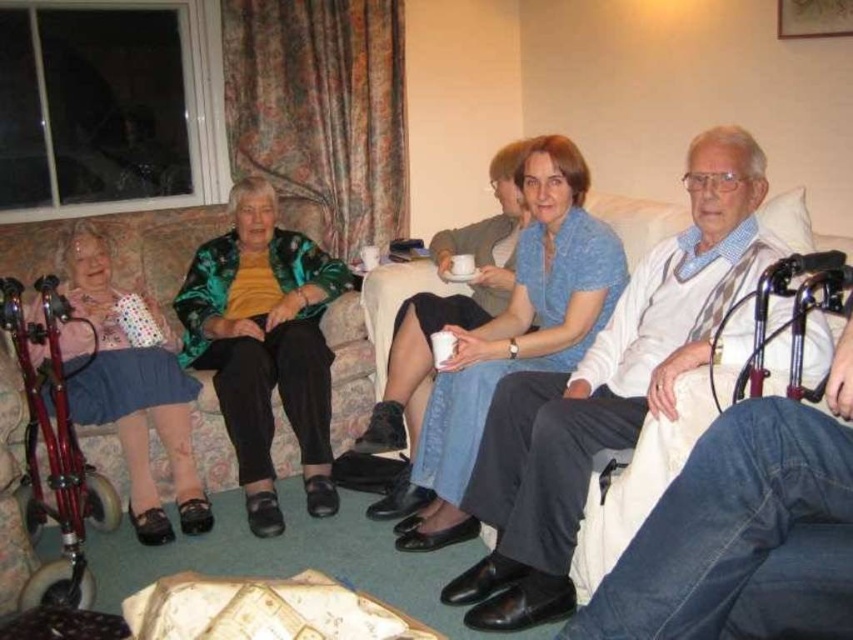
You are a tailor measuring the distance between the green metallic jacket at center and the blue cotton shirt at center for a custom fitting. The minimum required space for accurate measurements is 28 inches. Can you proceed with the measurements as they are?

The green metallic jacket at center is 27.78 inches from the blue cotton shirt at center. Since the required space is 28 inches, the distance is slightly insufficient. You may need to adjust their positions to ensure enough space for accurate measurements.

You are a guest entering the living room and need to place a small decorative item on the highest surface between the green metallic jacket at center and the velvet fabric couch at left. Which object should you choose?

The green metallic jacket at center is taller than the velvet fabric couch at left, so you should place the decorative item on the green metallic jacket at center.

You are standing in the living room and want to place a small plant between the two points, point 1 at (276, 278) and point 2 at (358, 371). Which point is closer to you so the plant can be placed nearer to it?

Point 1 at (276, 278) is closer to you, so placing the plant near it would position it nearer to your current location.